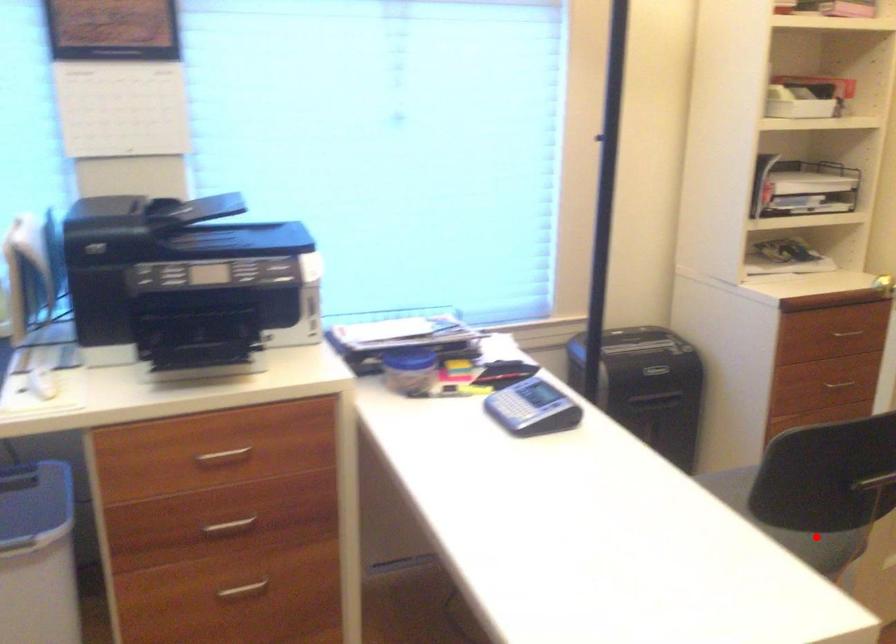
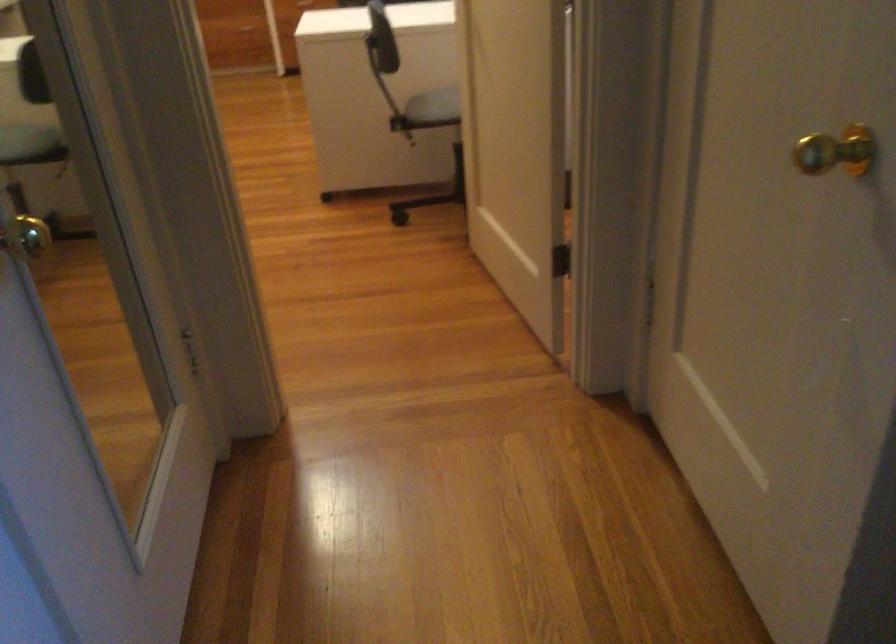
Find the pixel in the second image that matches the highlighted location in the first image.

(434, 106)